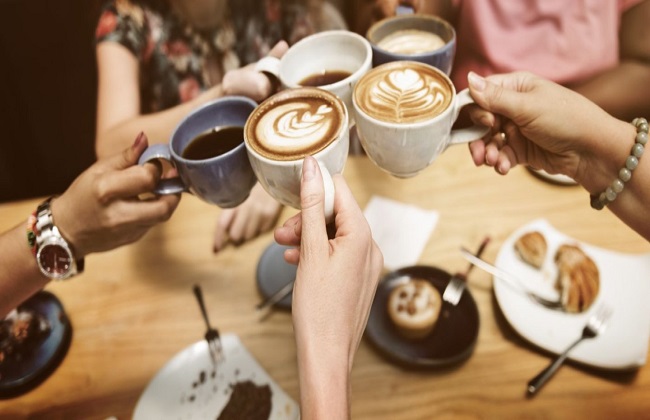
Locate an element on the screen. The height and width of the screenshot is (420, 650). cups with tea or coffee is located at coordinates (309, 155), (221, 164), (326, 71), (406, 54), (395, 94).